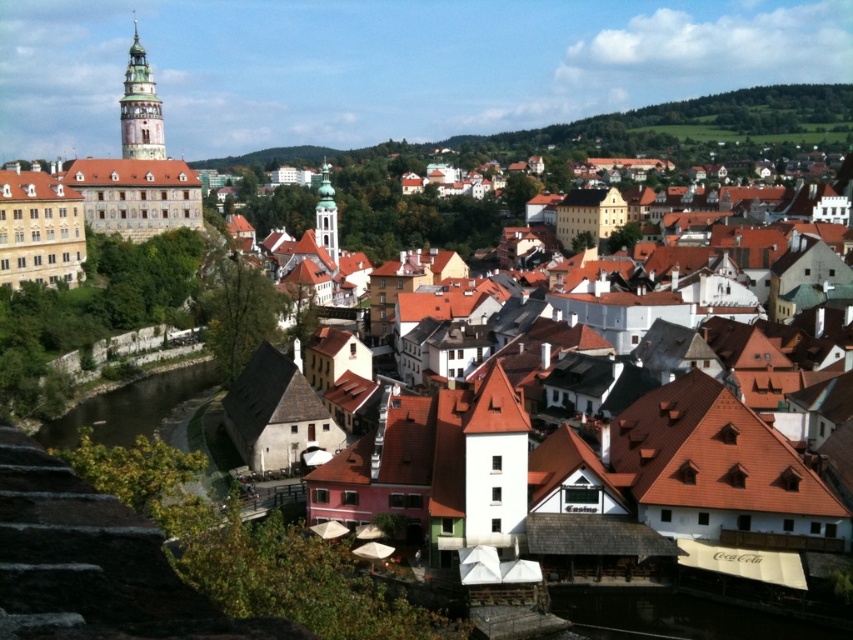
You are a GUI agent. You are given a task and a screenshot of the screen. Output one action in this format:
    pyautogui.click(x=<x>, y=<y>)
    Task: Click on the green stone tower at upper left
    The image size is (853, 640).
    Given the screenshot: What is the action you would take?
    pyautogui.click(x=140, y=108)

Does green stone tower at upper left have a smaller size compared to green glass tower at center?

Indeed, green stone tower at upper left has a smaller size compared to green glass tower at center.

Between point (140, 138) and point (314, 232), which one is positioned behind?

The point (314, 232) is behind.

At what (x,y) coordinates should I click in order to perform the action: click on green stone tower at upper left. Please return your answer as a coordinate pair (x, y). This screenshot has width=853, height=640. Looking at the image, I should click on (140, 108).

Which is below, brown concrete river at lower left or green stone tower at upper left?

brown concrete river at lower left is below.

The height and width of the screenshot is (640, 853). I want to click on brown concrete river at lower left, so click(128, 406).

Does brown tiled roofs at center have a lesser width compared to brown concrete river at lower left?

No, brown tiled roofs at center is not thinner than brown concrete river at lower left.

Image resolution: width=853 pixels, height=640 pixels. What are the coordinates of `brown tiled roofs at center` in the screenshot? It's located at (579, 481).